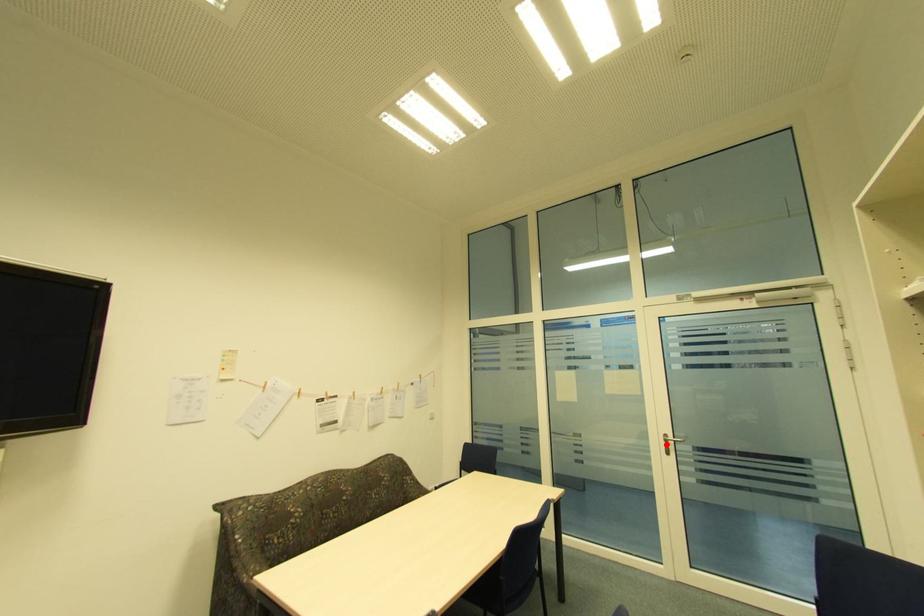
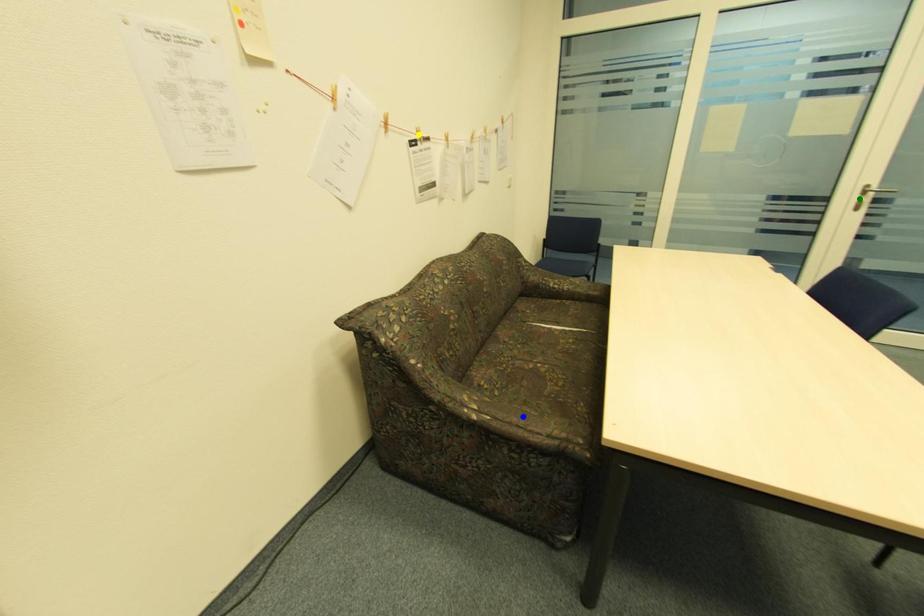
Question: I am providing you with two images of the same scene from different viewpoints. A red point is marked on the first image. You are given multiple points on the second image. In image 2, which mark is for the same physical point as the one in image 1?

Choices:
 (A) blue point
 (B) yellow point
 (C) green point

Answer: (C)